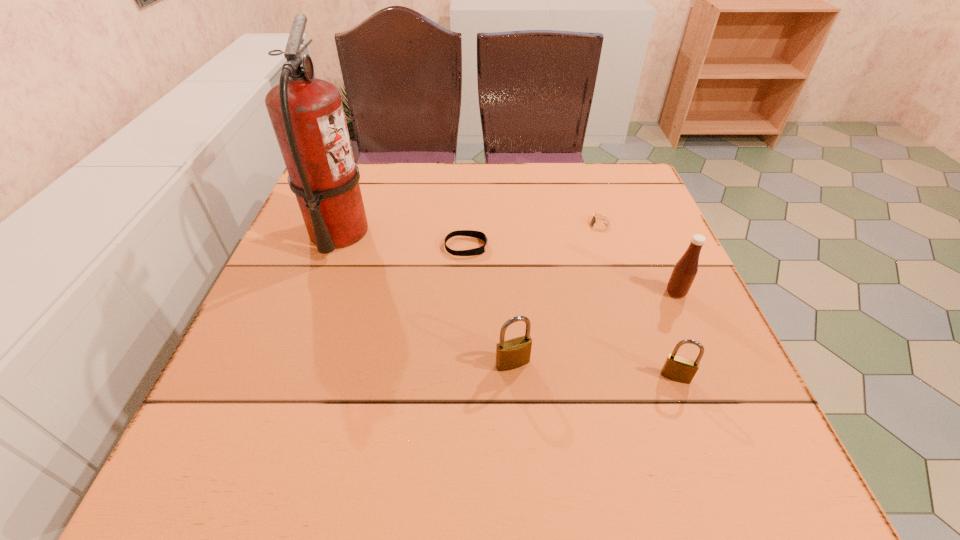
Where is `the taller padlock`? The width and height of the screenshot is (960, 540). the taller padlock is located at coordinates (x=511, y=354).

Identify the location of the left padlock. The image size is (960, 540). (511, 354).

This screenshot has width=960, height=540. I want to click on the shorter padlock, so click(x=677, y=368).

Where is `the right padlock`? the right padlock is located at coordinates (677, 368).

Where is `Tabasco sauce`? Tabasco sauce is located at coordinates (685, 270).

Locate an element on the screen. the fourth farthest object is located at coordinates (685, 270).

Image resolution: width=960 pixels, height=540 pixels. Identify the location of watch. (597, 225).

Where is `the leftmost object`? the leftmost object is located at coordinates (307, 115).

The image size is (960, 540). I want to click on the tallest object, so click(307, 115).

In order to click on the second object from left to right in this screenshot , I will do pos(470,233).